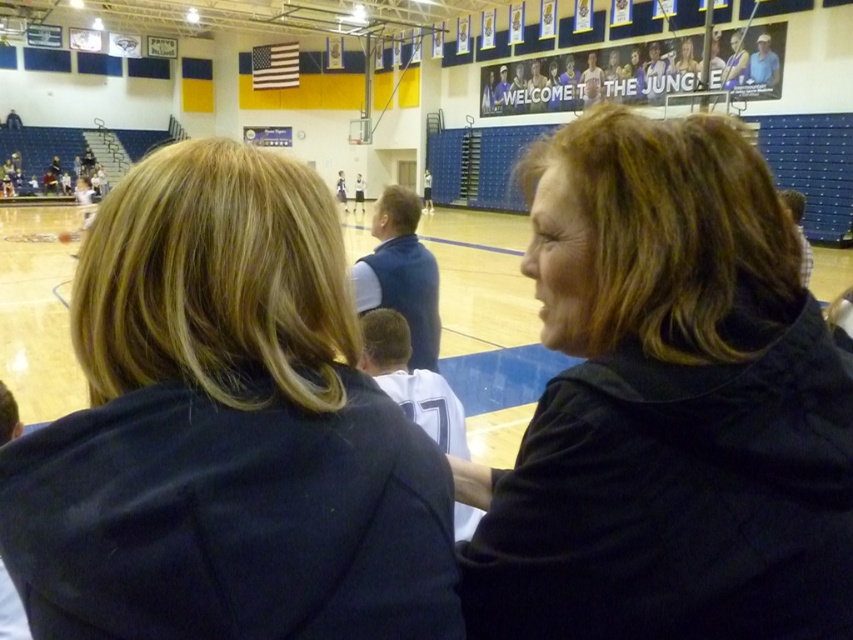
You are a basketball player standing at the point with coordinates point (567,525) and want to pass the ball to a teammate located at point (735,65). Considering the positions of the two seated individuals in the foreground, will your pass be obstructed?

The point (567,525) is in front of point (735,65), so the pass from point (567,525) to point (735,65) would not be obstructed by the seated individuals since the starting point is closer to the viewer and the destination is further back.

You are organizing a gymnasium inventory and need to store the dark blue jacket at upper left and the blue jersey at upper center. Which item requires more storage space?

The blue jersey at upper center requires more storage space because it occupies more space than the dark blue jacket at upper left.

You are a gym coach observing the basketball game. You notice the dark blue jacket at upper left and the black matte jacket at center. Which jacket is covering part of the other?

The dark blue jacket at upper left is positioned over the black matte jacket at center, so it is covering part of the black matte jacket at center.